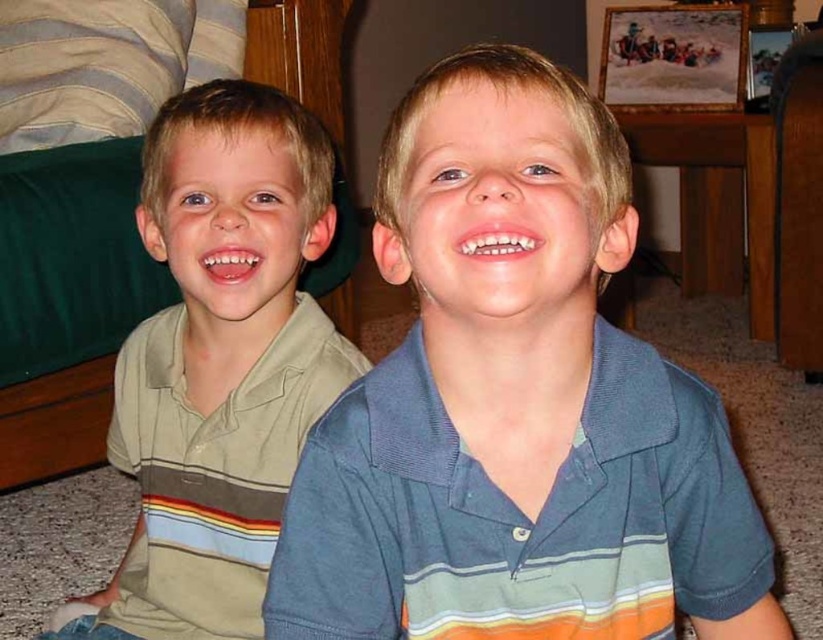
You are a photographer trying to decide which shirt to focus on for a closeup. The blue striped polo shirt at center and the light brown striped polo shirt at left are both in the frame. Which shirt should you choose if you want to capture the larger one?

The light brown striped polo shirt at left is larger than the blue striped polo shirt at center, so you should focus on the light brown striped polo shirt at left for the closeup.

You are a photographer trying to focus on the blue striped polo shirt at center and the light brown striped polo shirt at left. Which one is positioned higher in the image?

The blue striped polo shirt at center is positioned higher in the image than the light brown striped polo shirt at left.